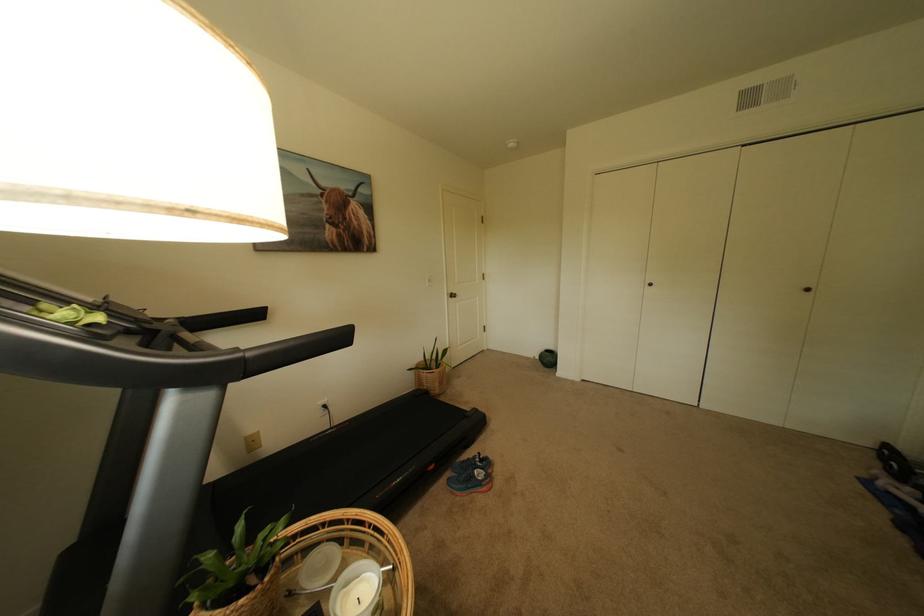
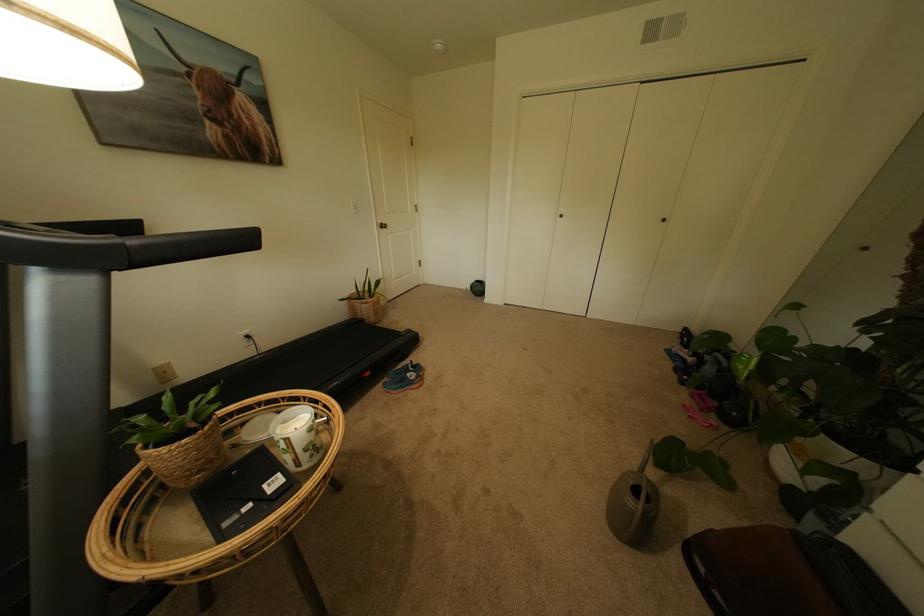
Where in the second image is the point corresponding to (x=446, y=385) from the first image?

(382, 314)